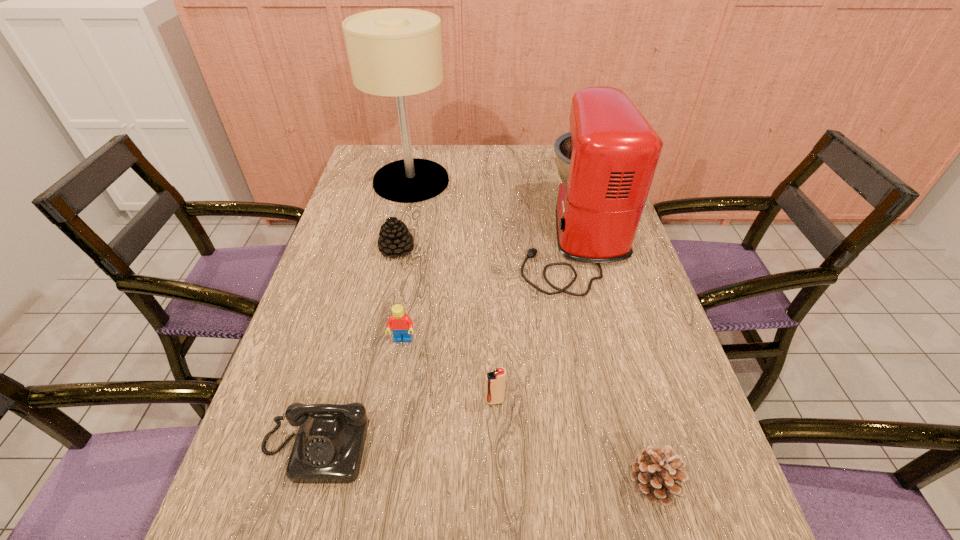
Image resolution: width=960 pixels, height=540 pixels. What are the coordinates of `free space that satisfies the following two spatial constraints: 1. at the narrow end of the nearer pinecone; 2. on the left side of the farther pinecone` in the screenshot? It's located at (348, 484).

Locate an element on the screen. Image resolution: width=960 pixels, height=540 pixels. free space that satisfies the following two spatial constraints: 1. on the front-facing side of the kitchen mixer; 2. on the dial of the telephone is located at coordinates (622, 448).

Find the location of a particular element. The image size is (960, 540). vacant position in the image that satisfies the following two spatial constraints: 1. on the face of the Lego; 2. on the left side of the right pinecone is located at coordinates pyautogui.click(x=380, y=484).